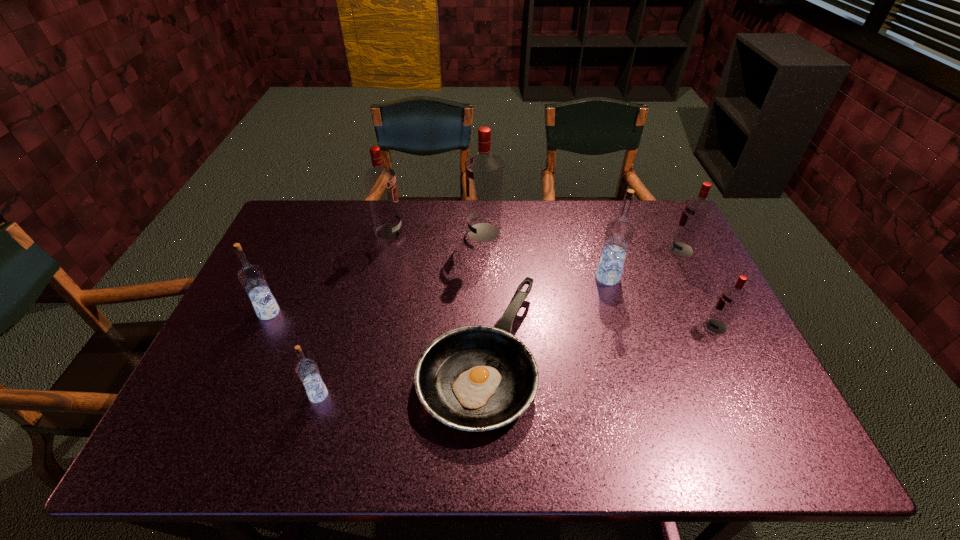
Locate an element on the screen. The image size is (960, 540). the closest vodka relative to the nearest vodka is located at coordinates (251, 277).

The width and height of the screenshot is (960, 540). In order to click on the fourth closest vodka to the red frying pan in this screenshot , I will do `click(380, 181)`.

Identify which red vodka is located as the third nearest to the biggest blue vodka. Please provide its 2D coordinates. Your answer should be formatted as a tuple, i.e. [(x, y)], where the tuple contains the x and y coordinates of a point satisfying the conditions above.

[(483, 170)]

At what (x,y) coordinates should I click in order to perform the action: click on red vodka that is the second nearest to the nearest blue vodka. Please return your answer as a coordinate pair (x, y). This screenshot has width=960, height=540. Looking at the image, I should click on (483, 170).

Identify which blue vodka is the second nearest to the smallest red vodka. Please provide its 2D coordinates. Your answer should be formatted as a tuple, i.e. [(x, y)], where the tuple contains the x and y coordinates of a point satisfying the conditions above.

[(307, 370)]

Identify which blue vodka is the closest to the nearest vodka. Please provide its 2D coordinates. Your answer should be formatted as a tuple, i.e. [(x, y)], where the tuple contains the x and y coordinates of a point satisfying the conditions above.

[(251, 277)]

At what (x,y) coordinates should I click in order to perform the action: click on vacant area that satisfies the following two spatial constraints: 1. on the front label of the third smallest red vodka; 2. on the back side of the shortest object. Please return your answer as a coordinate pair (x, y). Looking at the image, I should click on (360, 355).

Where is `free location that satisfies the following two spatial constraints: 1. on the front label of the fourth farthest object; 2. on the right side of the third object from left to right`? The height and width of the screenshot is (540, 960). free location that satisfies the following two spatial constraints: 1. on the front label of the fourth farthest object; 2. on the right side of the third object from left to right is located at coordinates (378, 278).

Identify the location of free space in the image that satisfies the following two spatial constraints: 1. on the front label of the fourth vodka from left to right; 2. on the front side of the leftmost vodka. (485, 313).